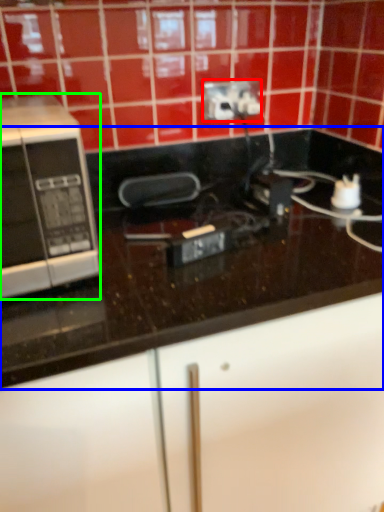
Question: Based on their relative distances, which object is farther from power plugs and sockets (highlighted by a red box)? Choose from countertop (highlighted by a blue box) and microwave oven (highlighted by a green box).

Choices:
 (A) countertop
 (B) microwave oven

Answer: (B)